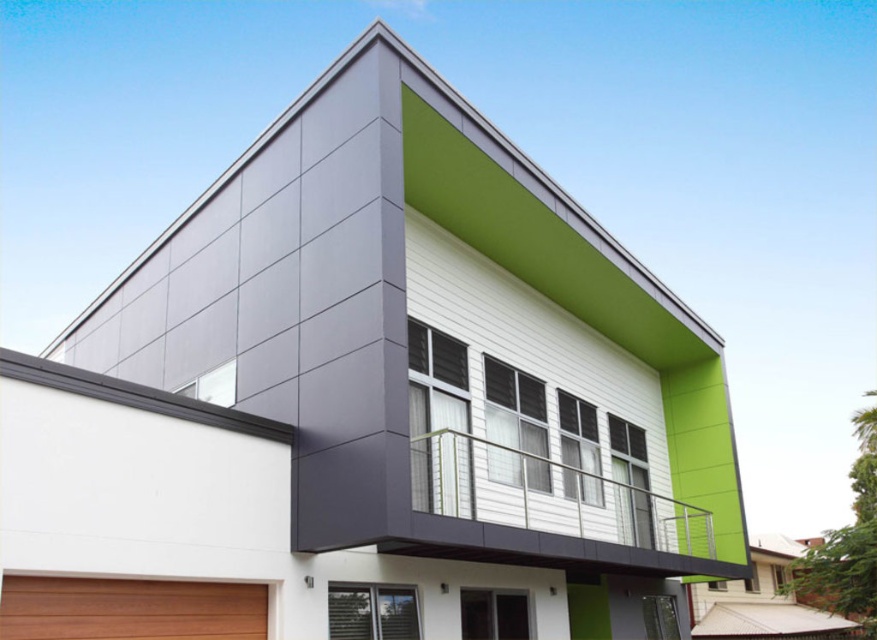
Question: Which point is farther to the camera?

Choices:
 (A) (540, 528)
 (B) (223, 584)

Answer: (A)

Question: Does metallic silver balcony at upper center appear over brown wood at lower left?

Choices:
 (A) no
 (B) yes

Answer: (A)

Question: Does metallic silver balcony at upper center appear on the right side of brown wood at lower left?

Choices:
 (A) yes
 (B) no

Answer: (A)

Question: Which object is farther from the camera taking this photo?

Choices:
 (A) metallic silver balcony at upper center
 (B) brown wood at lower left

Answer: (A)

Question: Is metallic silver balcony at upper center to the right of brown wood at lower left from the viewer's perspective?

Choices:
 (A) yes
 (B) no

Answer: (A)